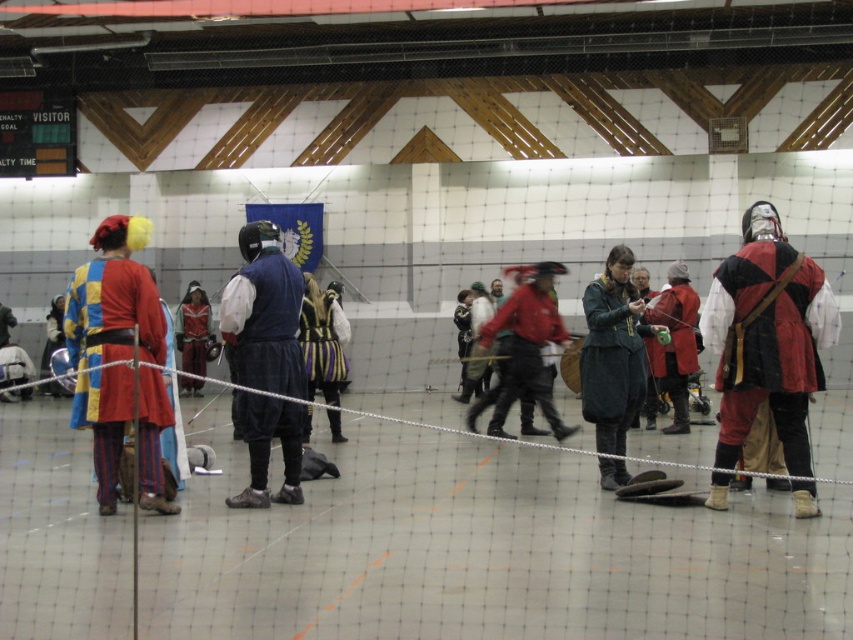
Question: Which object appears closest to the camera in this image?

Choices:
 (A) shiny silver armor at center
 (B) striped velvet cape at center
 (C) matte red and black vest at right
 (D) matte blue vest at center

Answer: (C)

Question: From the image, what is the correct spatial relationship of matte blue vest at center in relation to red velvet cape at center?

Choices:
 (A) right
 (B) left

Answer: (B)

Question: Is matte multicolored tunic at left bigger than striped velvet cape at center?

Choices:
 (A) yes
 (B) no

Answer: (A)

Question: Among these points, which one is farthest from the camera?

Choices:
 (A) (622, 280)
 (B) (148, 330)
 (C) (813, 349)
 (D) (309, 397)

Answer: (D)

Question: Does matte red and black vest at right lie in front of matte multicolored tunic at left?

Choices:
 (A) yes
 (B) no

Answer: (B)

Question: Among these points, which one is farthest from the camera?

Choices:
 (A) (271, 380)
 (B) (148, 461)

Answer: (A)